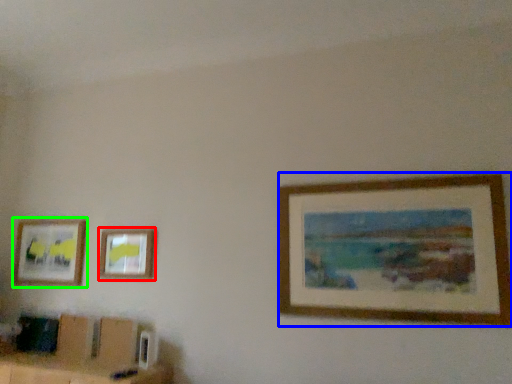
Question: Which is farther away from picture frame (highlighted by a red box)? picture frame (highlighted by a blue box) or picture frame (highlighted by a green box)?

Choices:
 (A) picture frame
 (B) picture frame

Answer: (A)